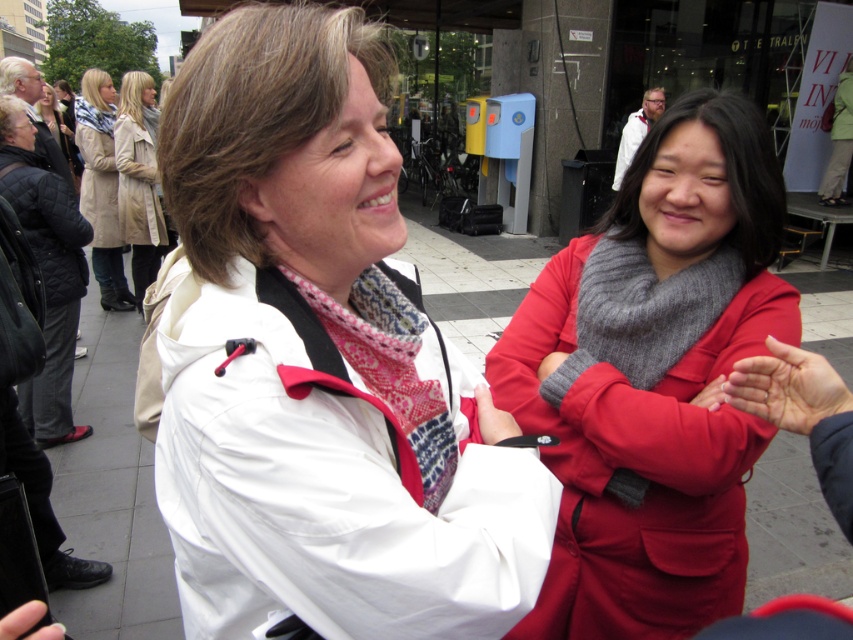
Is point (242, 264) closer to camera compared to point (757, 362)?

That is True.

Who is shorter, white matte jacket at center or smooth skin hand at center?

With less height is smooth skin hand at center.

At what (x,y) coordinates should I click in order to perform the action: click on white matte jacket at center. Please return your answer as a coordinate pair (x, y). Image resolution: width=853 pixels, height=640 pixels. Looking at the image, I should click on (318, 362).

Find the location of `white matte jacket at center`. white matte jacket at center is located at coordinates (318, 362).

Who is more distant from viewer, (271, 196) or (19, 616)?

The point (271, 196) is more distant.

Which of these two, white matte jacket at center or matte black phone at lower left, stands taller?

With more height is white matte jacket at center.

Which is in front, point (318, 346) or point (13, 621)?

Point (13, 621) is in front.

Where is `white matte jacket at center`? white matte jacket at center is located at coordinates coord(318,362).

Does matte red glove at center have a greater height compared to gray woolen scarf at upper right?

Correct, matte red glove at center is much taller as gray woolen scarf at upper right.

Which is more to the right, matte red glove at center or gray woolen scarf at upper right?

Positioned to the right is gray woolen scarf at upper right.

Who is more distant from viewer, (494, 420) or (718, 378)?

Point (718, 378)

In order to click on matte red glove at center in this screenshot , I will do pos(492,419).